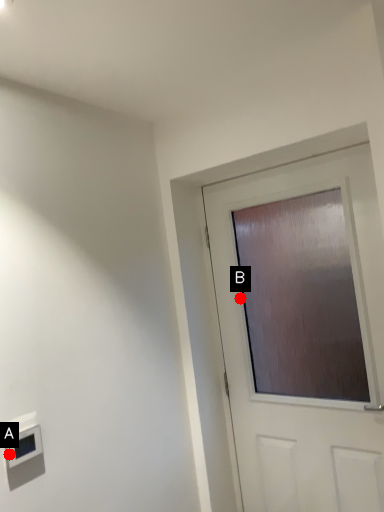
Question: Two points are circled on the image, labeled by A and B beside each circle. Which of the following is the farthest from the observer?

Choices:
 (A) A is further
 (B) B is further

Answer: (B)